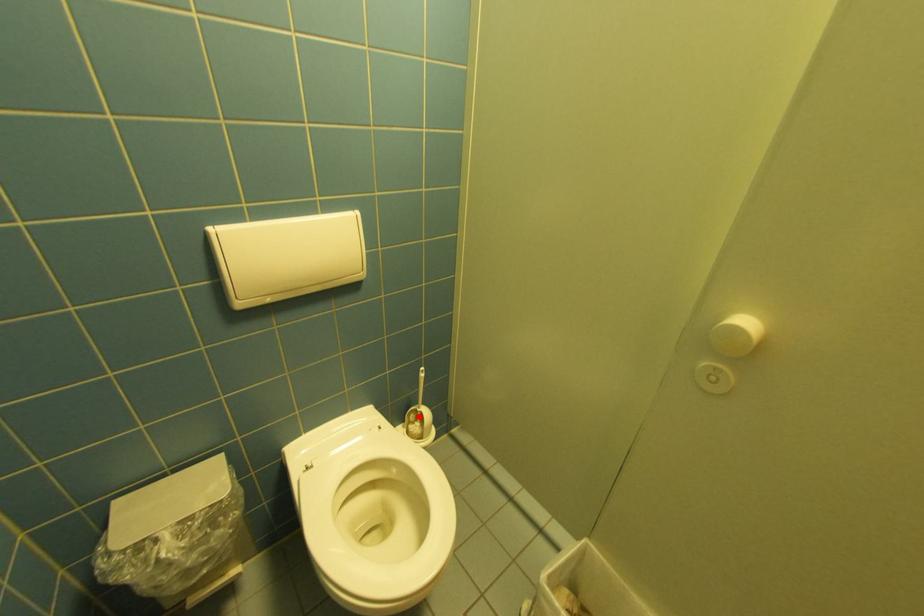
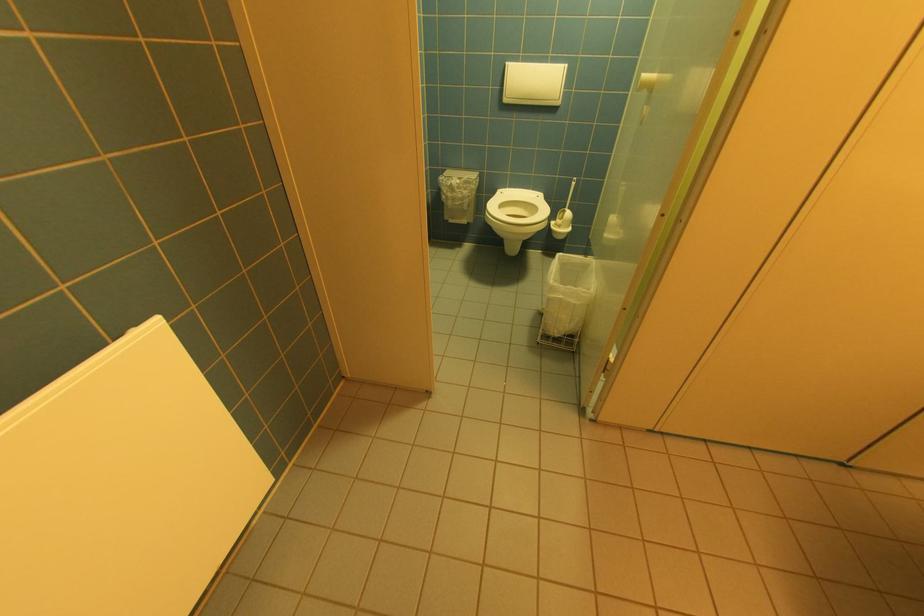
Where in the second image is the point corresponding to the highlighted location from the first image?

(567, 215)